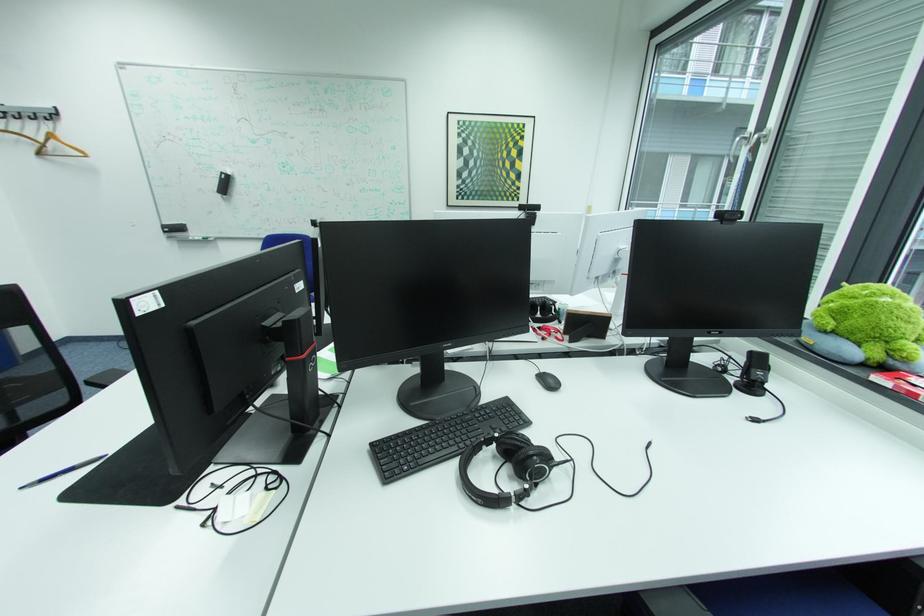
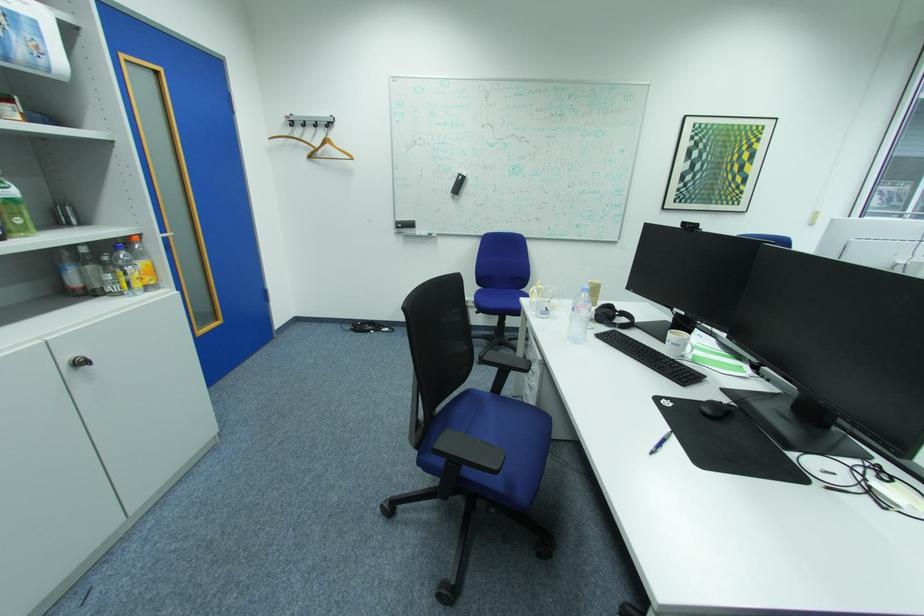
Question: The images are taken continuously from a first-person perspective. In which direction are you moving?

Choices:
 (A) Left
 (B) Right
 (C) Forward
 (D) Backward

Answer: (A)